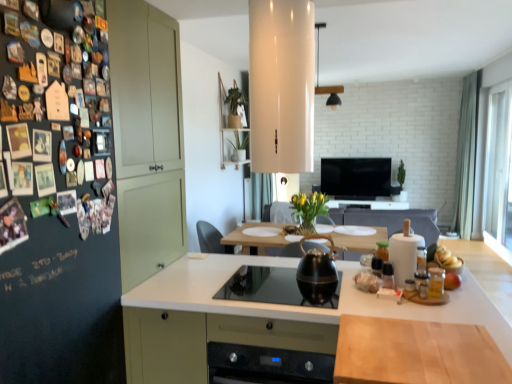
The width and height of the screenshot is (512, 384). What do you see at coordinates (356, 178) in the screenshot?
I see `black glossy tv at center` at bounding box center [356, 178].

Looking at this image, in order to face wooden cutting board at lower right, which is counted as the 1th countertop, starting from the top, should I rotate leftwards or rightwards?

It's best to rotate right around 20.696 degrees.

Describe the element at coordinates (416, 352) in the screenshot. I see `wooden cutting board at lower right, the second countertop positioned from the back` at that location.

The width and height of the screenshot is (512, 384). What do you see at coordinates (261, 317) in the screenshot? I see `white glossy countertop at center, the 2th countertop viewed from the front` at bounding box center [261, 317].

Describe the element at coordinates (309, 207) in the screenshot. The height and width of the screenshot is (384, 512). I see `yellow matte vase at center` at that location.

What is the approximate width of shiny black kettle at center?

The width of shiny black kettle at center is 23.26 centimeters.

What do you see at coordinates (317, 272) in the screenshot? I see `shiny black kettle at center` at bounding box center [317, 272].

In order to face translucent glass jar at right, which ranks as the 1th food in bottom-to-top order, should I rotate leftwards or rightwards?

To align with it, rotate right about 24.775°.

At what (x,y) coordinates should I click in order to perform the action: click on black glass gas stove at center. Please return your answer as a coordinate pair (x, y). The height and width of the screenshot is (384, 512). Looking at the image, I should click on (263, 286).

The image size is (512, 384). I want to click on yellow matte bananas at right, which is counted as the second food, starting from the front, so click(446, 258).

Where is `television below the transparent glass window at right (from the image's perspective)`? This screenshot has width=512, height=384. television below the transparent glass window at right (from the image's perspective) is located at coordinates (356, 178).

Is there a large distance between transparent glass window at right and black glossy tv at center?

transparent glass window at right is far away from black glossy tv at center.

From the picture: Is transparent glass window at right further to the viewer compared to black glossy tv at center?

No, it is not.

How different are the orientations of transparent glass window at right and black glossy tv at center in degrees?

The facing directions of transparent glass window at right and black glossy tv at center are 89.8 degrees apart.

Consider the image. Which object is closer to the camera taking this photo, transparent glass window at right or white glossy countertop at center, the 2th countertop viewed from the front?

white glossy countertop at center, the 2th countertop viewed from the front.

Considering the sizes of objects transparent glass window at right and white glossy countertop at center, the 2th countertop viewed from the front, in the image provided, who is taller, transparent glass window at right or white glossy countertop at center, the 2th countertop viewed from the front,?

With more height is transparent glass window at right.

From a real-world perspective, is transparent glass window at right physically located above or below white glossy countertop at center, which appears as the 1th countertop when viewed from the back?

Clearly, from a real-world perspective, transparent glass window at right is above white glossy countertop at center, which appears as the 1th countertop when viewed from the back.

Is point (490, 207) closer to viewer compared to point (231, 265)?

No, (490, 207) is further to viewer.

Image resolution: width=512 pixels, height=384 pixels. Find the location of `food that is the 1st one when counting upward from the wooden cutting board at lower right, which is counted as the 1th countertop, starting from the top (from the image's perspective)`. food that is the 1st one when counting upward from the wooden cutting board at lower right, which is counted as the 1th countertop, starting from the top (from the image's perspective) is located at coordinates (452, 281).

Based on the photo, can you tell me how much wooden cutting board at lower right, which is the second countertop in bottom-to-top order, and translucent glass jar at right, marked as the second food in a back-to-front arrangement, differ in facing direction?

0.69 degrees.

Is wooden cutting board at lower right, marked as the 1th countertop in a front-to-back arrangement, smaller than translucent glass jar at right, marked as the 1th food in a front-to-back arrangement?

Incorrect, wooden cutting board at lower right, marked as the 1th countertop in a front-to-back arrangement, is not smaller in size than translucent glass jar at right, marked as the 1th food in a front-to-back arrangement.

Consider the image. From the image's perspective, is wooden cutting board at lower right, marked as the 1th countertop in a front-to-back arrangement, positioned above or below translucent glass jar at right, marked as the 1th food in a front-to-back arrangement?

From the image's perspective, wooden cutting board at lower right, marked as the 1th countertop in a front-to-back arrangement, appears below translucent glass jar at right, marked as the 1th food in a front-to-back arrangement.

Between wooden cutting board at lower right, which is counted as the 1th countertop, starting from the top, and dark matte board at left, which one has smaller size?

wooden cutting board at lower right, which is counted as the 1th countertop, starting from the top, is smaller.

Considering the relative positions of wooden cutting board at lower right, which is counted as the 1th countertop, starting from the top, and dark matte board at left in the image provided, is wooden cutting board at lower right, which is counted as the 1th countertop, starting from the top, to the left of dark matte board at left from the viewer's perspective?

In fact, wooden cutting board at lower right, which is counted as the 1th countertop, starting from the top, is to the right of dark matte board at left.

Based on the photo, from a real-world perspective, between wooden cutting board at lower right, marked as the 1th countertop in a front-to-back arrangement, and dark matte board at left, who is vertically lower?

From a 3D spatial view, wooden cutting board at lower right, marked as the 1th countertop in a front-to-back arrangement, is below.

Which is more to the left, white glossy countertop at center, the 2th countertop from the top, or wooden cutting board at lower right, the second countertop positioned from the back?

From the viewer's perspective, white glossy countertop at center, the 2th countertop from the top, appears more on the left side.

Is point (368, 305) closer or farther from the camera than point (411, 359)?

Point (368, 305) is positioned farther from the camera compared to point (411, 359).

Is wooden cutting board at lower right, which is the second countertop in bottom-to-top order, surrounded by white glossy countertop at center, marked as the first countertop in a bottom-to-top arrangement?

No, wooden cutting board at lower right, which is the second countertop in bottom-to-top order, is not a part of white glossy countertop at center, marked as the first countertop in a bottom-to-top arrangement.

Is white glossy countertop at center, the 2th countertop viewed from the front, facing towards wooden cutting board at lower right, which is counted as the 1th countertop, starting from the top?

No, white glossy countertop at center, the 2th countertop viewed from the front, is not facing towards wooden cutting board at lower right, which is counted as the 1th countertop, starting from the top.

Between shiny black kettle at center and yellow matte bananas at right, which ranks as the 2th food in bottom-to-top order, which one appears on the right side from the viewer's perspective?

yellow matte bananas at right, which ranks as the 2th food in bottom-to-top order.

From a real-world perspective, who is located higher, shiny black kettle at center or yellow matte bananas at right, which ranks as the first food in back-to-front order?

shiny black kettle at center is physically above.

How many degrees apart are the facing directions of shiny black kettle at center and yellow matte bananas at right, which ranks as the 2th food in bottom-to-top order?

0.000832 degrees separate the facing orientations of shiny black kettle at center and yellow matte bananas at right, which ranks as the 2th food in bottom-to-top order.

Is the depth of shiny black kettle at center greater than that of yellow matte bananas at right, which ranks as the 2th food in bottom-to-top order?

No, it is not.

Based on the photo, would you say shiny black kettle at center is to the left or to the right of wooden cutting board at lower right, the second countertop positioned from the back, in the picture?

Based on their positions, shiny black kettle at center is located to the left of wooden cutting board at lower right, the second countertop positioned from the back.

From the picture: Does shiny black kettle at center have a lesser width compared to wooden cutting board at lower right, which is counted as the 1th countertop, starting from the top?

Yes.

From the image's perspective, would you say shiny black kettle at center is shown under wooden cutting board at lower right, which is the second countertop in bottom-to-top order?

No.

From a real-world perspective, which countertop is the 1st one underneath the shiny black kettle at center? Please provide its 2D coordinates.

[(416, 352)]

Find the location of a particular element. This screenshot has height=384, width=512. window above the black glossy tv at center (from the image's perspective) is located at coordinates coord(498,172).

This screenshot has height=384, width=512. Find the location of `window behind the white glossy countertop at center, marked as the first countertop in a bottom-to-top arrangement`. window behind the white glossy countertop at center, marked as the first countertop in a bottom-to-top arrangement is located at coordinates (498, 172).

From the picture: Looking at the image, which one is located closer to yellow matte vase at center, wooden cutting board at lower right, marked as the 1th countertop in a front-to-back arrangement, or transparent glass window at right?

transparent glass window at right lies closer to yellow matte vase at center than the other object.

Based on their spatial positions, is white glossy countertop at center, which appears as the 1th countertop when viewed from the back, or transparent glass window at right closer to dark matte board at left?

white glossy countertop at center, which appears as the 1th countertop when viewed from the back, is positioned closer to the anchor dark matte board at left.

Looking at the image, which one is located closer to transparent glass window at right, black glass gas stove at center or dark matte board at left?

black glass gas stove at center is positioned closer to the anchor transparent glass window at right.

Looking at the image, which one is located closer to dark matte board at left, yellow matte vase at center or black glass gas stove at center?

black glass gas stove at center is closer to dark matte board at left.

From the image, which object appears to be farther from translucent glass jar at right, marked as the second food in a back-to-front arrangement, white glossy countertop at center, which appears as the 1th countertop when viewed from the back, or yellow matte bananas at right, which ranks as the 2th food in bottom-to-top order?

white glossy countertop at center, which appears as the 1th countertop when viewed from the back, is positioned further to the anchor translucent glass jar at right, marked as the second food in a back-to-front arrangement.

Considering their positions, is transparent glass window at right positioned closer to shiny black kettle at center than black glossy tv at center?

Among the two, transparent glass window at right is located nearer to shiny black kettle at center.

Looking at this image, when comparing their distances from translucent glass jar at right, marked as the 1th food in a front-to-back arrangement, does transparent glass window at right or shiny black kettle at center seem further?

transparent glass window at right is positioned further to the anchor translucent glass jar at right, marked as the 1th food in a front-to-back arrangement.

Based on their spatial positions, is yellow matte vase at center or transparent glass window at right closer to white glossy countertop at center, which appears as the 1th countertop when viewed from the back?

The object closer to white glossy countertop at center, which appears as the 1th countertop when viewed from the back, is yellow matte vase at center.

At what (x,y) coordinates should I click in order to perform the action: click on kitchen appliance positioned between wooden cutting board at lower right, which is counted as the 1th countertop, starting from the top, and black glossy tv at center from near to far. Please return your answer as a coordinate pair (x, y). The height and width of the screenshot is (384, 512). Looking at the image, I should click on (317, 272).

This screenshot has height=384, width=512. I want to click on countertop between white glossy countertop at center, which appears as the 1th countertop when viewed from the back, and translucent glass jar at right, the 2th food positioned from the top, in the horizontal direction, so click(416, 352).

Locate an element on the screen. window between translucent glass jar at right, marked as the 1th food in a front-to-back arrangement, and black glossy tv at center from front to back is located at coordinates [498, 172].

Identify the location of kitchen appliance located between dark matte board at left and yellow matte bananas at right, which ranks as the 2th food in bottom-to-top order, in the left-right direction. (317, 272).